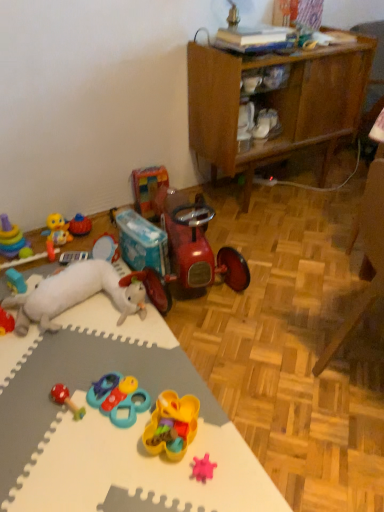
Where is `vacant area to the left of pink rubber star at lower center, which is counted as the 1th toy, starting from the right`? This screenshot has width=384, height=512. vacant area to the left of pink rubber star at lower center, which is counted as the 1th toy, starting from the right is located at coordinates (151, 468).